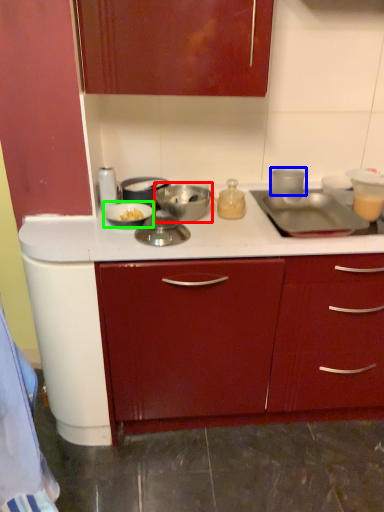
Question: Which is nearer to the kitchen appliance (highlighted by a red box)? kitchen appliance (highlighted by a blue box) or kitchen appliance (highlighted by a green box).

Choices:
 (A) kitchen appliance
 (B) kitchen appliance

Answer: (B)